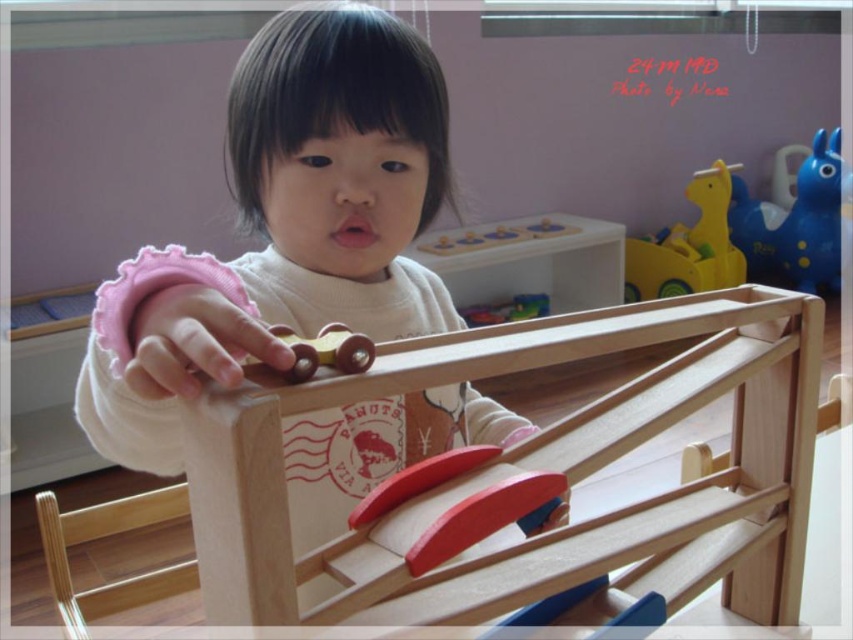
Question: Which object appears farthest from the camera in this image?

Choices:
 (A) wooden toy at center
 (B) wooden car at center
 (C) blue rubber horse at upper right
 (D) wooden toy car at center

Answer: (C)

Question: Estimate the real-world distances between objects in this image. Which object is closer to the wooden toy car at center?

Choices:
 (A) wooden car at center
 (B) blue rubber horse at upper right
 (C) wooden toy at center

Answer: (C)

Question: Is yellow matte plastic toy horse at upper right positioned at the back of wooden car at center?

Choices:
 (A) yes
 (B) no

Answer: (A)

Question: From the image, what is the correct spatial relationship of wooden toy at center in relation to wooden toy car at center?

Choices:
 (A) left
 (B) right

Answer: (A)

Question: Which of the following is the farthest from the observer?

Choices:
 (A) blue rubber horse at upper right
 (B) wooden toy at center
 (C) wooden toy car at center
 (D) yellow matte plastic toy horse at upper right

Answer: (A)

Question: Is yellow matte plastic toy horse at upper right bigger than wooden toy car at center?

Choices:
 (A) yes
 (B) no

Answer: (A)